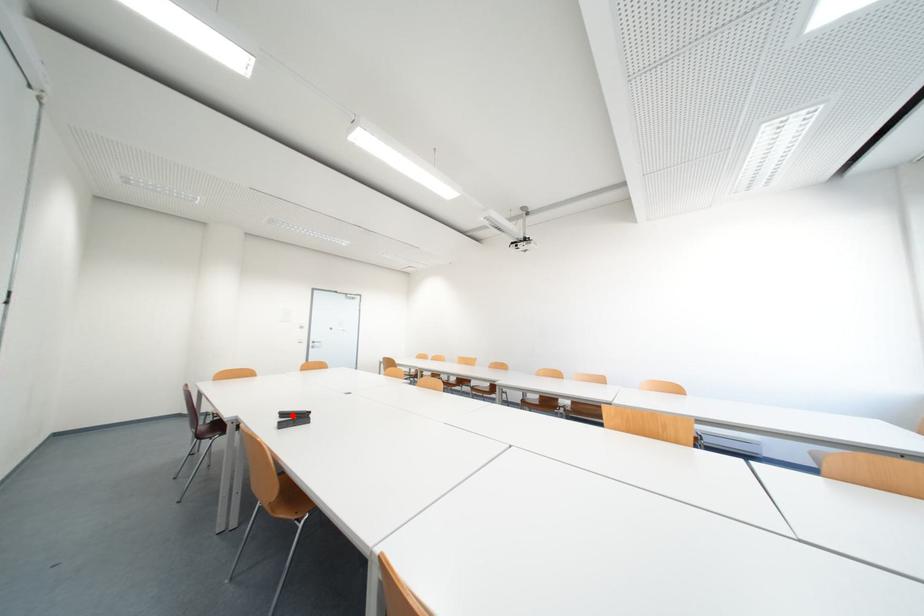
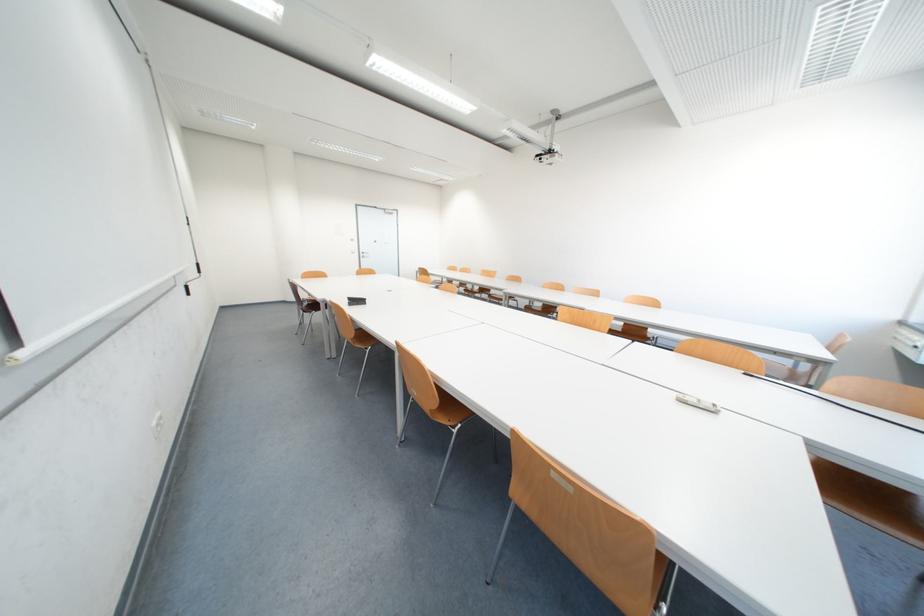
The point at the highlighted location is marked in the first image. Where is the corresponding point in the second image?

(359, 300)